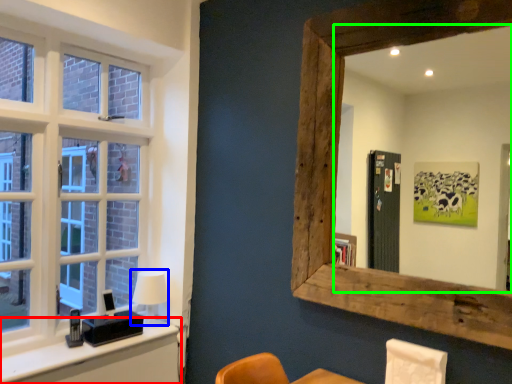
Question: Which object is the closest to the vanity (highlighted by a red box)? Choose among these: table lamp (highlighted by a blue box) or mirror (highlighted by a green box).

Choices:
 (A) table lamp
 (B) mirror

Answer: (A)